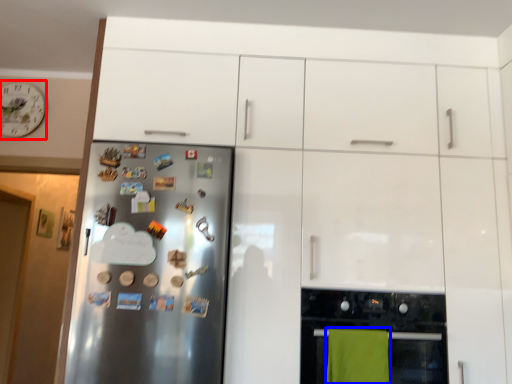
Question: Which object is further to the camera taking this photo, clock (highlighted by a red box) or beach towel (highlighted by a blue box)?

Choices:
 (A) clock
 (B) beach towel

Answer: (A)